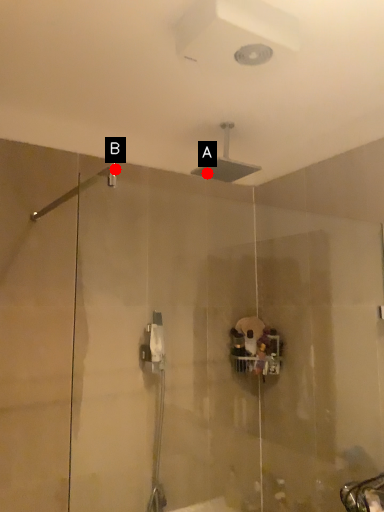
Question: Two points are circled on the image, labeled by A and B beside each circle. Which point is closer to the camera taking this photo?

Choices:
 (A) A is closer
 (B) B is closer

Answer: (B)